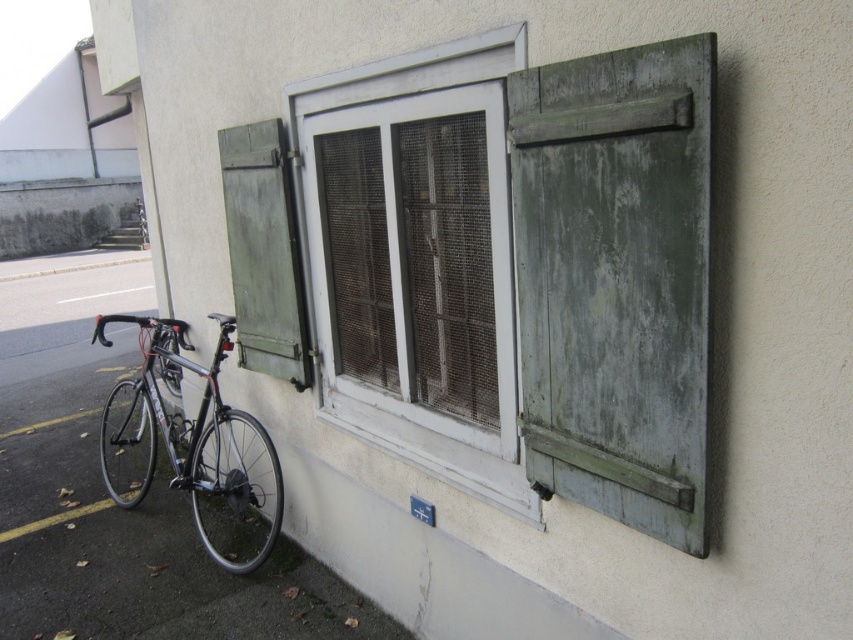
What do you see at coordinates (616, 280) in the screenshot? I see `green weathered wood shutter at right` at bounding box center [616, 280].

Does green weathered wood shutter at right appear on the right side of green weathered wood shutter at left?

Correct, you'll find green weathered wood shutter at right to the right of green weathered wood shutter at left.

Based on the photo, who is more forward, (662, 472) or (265, 321)?

Positioned in front is point (662, 472).

Find the location of `green weathered wood shutter at right`. green weathered wood shutter at right is located at coordinates (616, 280).

Which is behind, point (227, 237) or point (213, 397)?

The point (213, 397) is more distant.

Measure the distance from green weathered wood shutter at left to shiny metallic bicycle at left.

green weathered wood shutter at left is 69.60 centimeters away from shiny metallic bicycle at left.

Where is `green weathered wood shutter at left`? This screenshot has height=640, width=853. green weathered wood shutter at left is located at coordinates (264, 252).

Where is `green weathered wood shutter at left`? The image size is (853, 640). green weathered wood shutter at left is located at coordinates (264, 252).

Is point (366, 236) in front of point (103, 412)?

Yes, point (366, 236) is closer to viewer.

Which is behind, point (334, 323) or point (207, 490)?

Point (207, 490)

Measure the distance between green painted wood window at center and camera.

The distance of green painted wood window at center from camera is 1.90 meters.

Image resolution: width=853 pixels, height=640 pixels. In order to click on green painted wood window at center in this screenshot , I will do `click(415, 259)`.